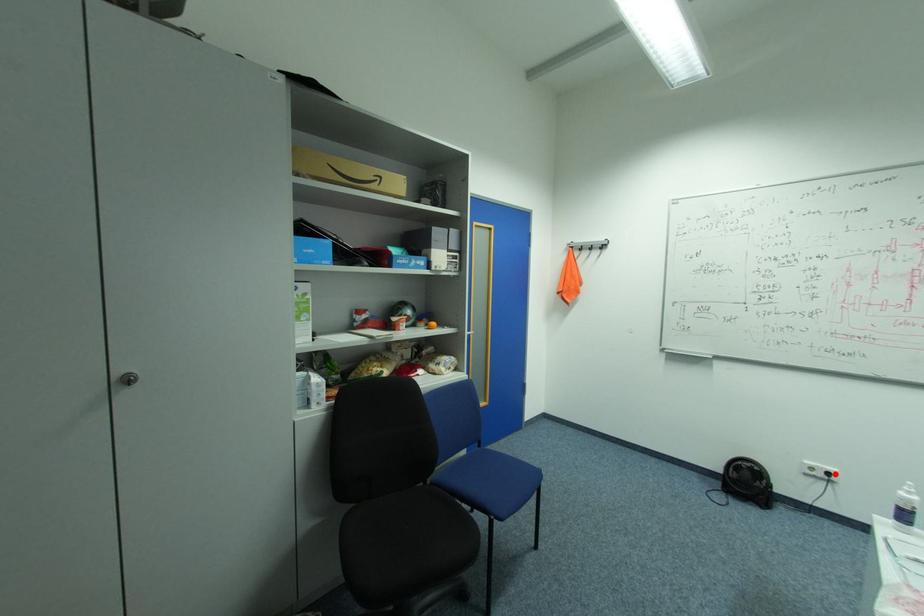
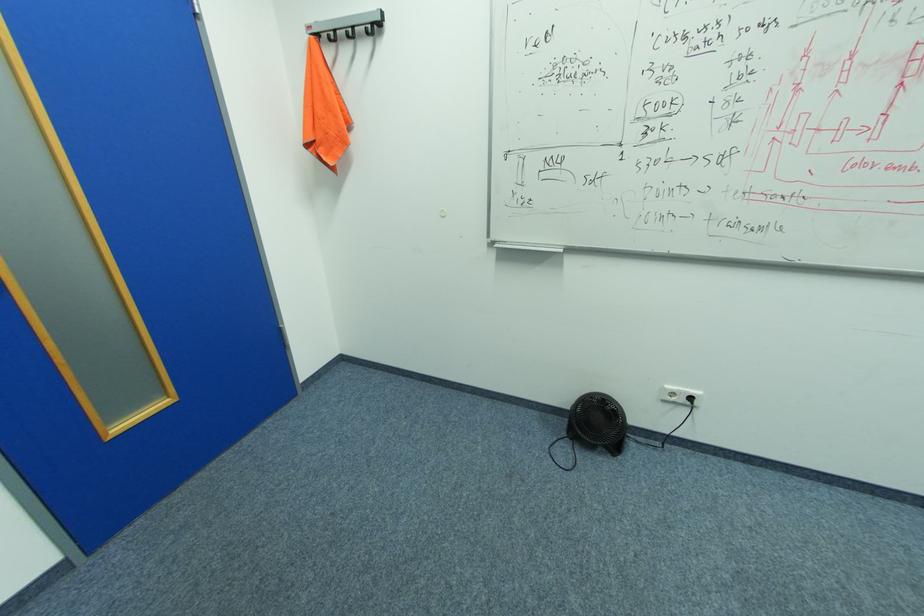
Find the pixel in the second image that matches the highlighted location in the first image.

(698, 399)